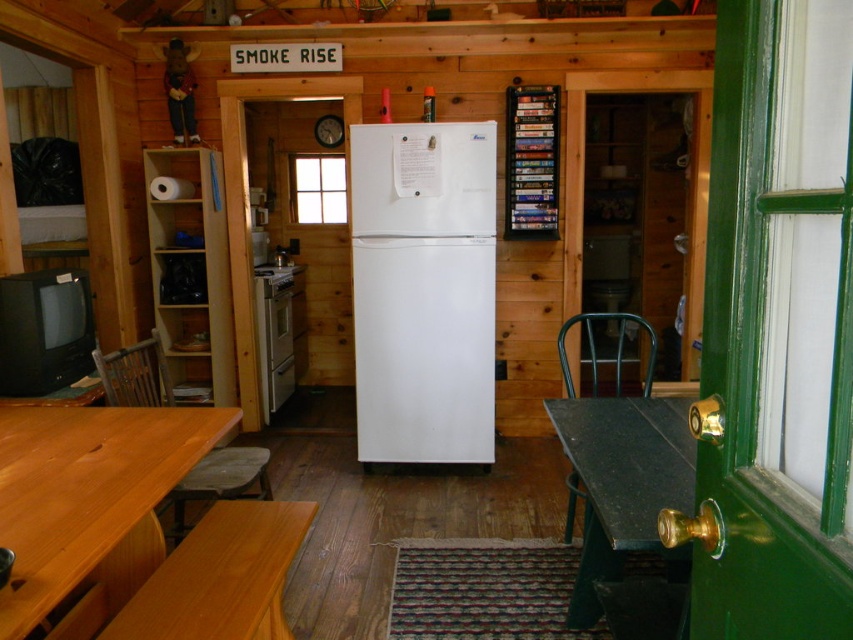
You are a delivery person who needs to place a large package that is 1.5 meters long on the floor between the light brown wood table at lower left and the camera. Is there enough space for the package to fit without overlapping either object?

The distance between the light brown wood table at lower left and the camera is 1.56 meters. Since the package is 1.5 meters long, there is enough space for it to fit between them without overlapping either object.

You are standing in the cabin kitchen and want to move from the refrigerator to the stove. You see two points marked on the floor at coordinates point (173,586) and point (125,394). Which point should you step on first if you want to take the shortest path to the stove?

Point (173,586) is in front of point (125,394), so stepping on point (173,586) first would be the shortest path towards the stove.

You are organizing a dinner party and need to move the green metal chair at right to access the white glossy oven at center. Can you move the chair to the right to create space?

The white glossy oven at center is positioned on the left side of the green metal chair at right, so moving the chair to the right would not create space. Instead, moving it to the left would allow access to the oven.